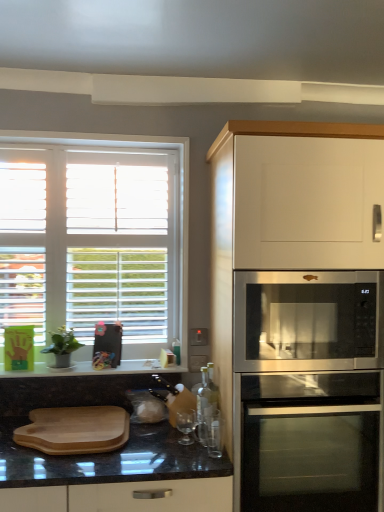
Locate an element on the screen. This screenshot has height=512, width=384. empty space that is ontop of granite black countertop at lower center (from a real-world perspective) is located at coordinates (100, 366).